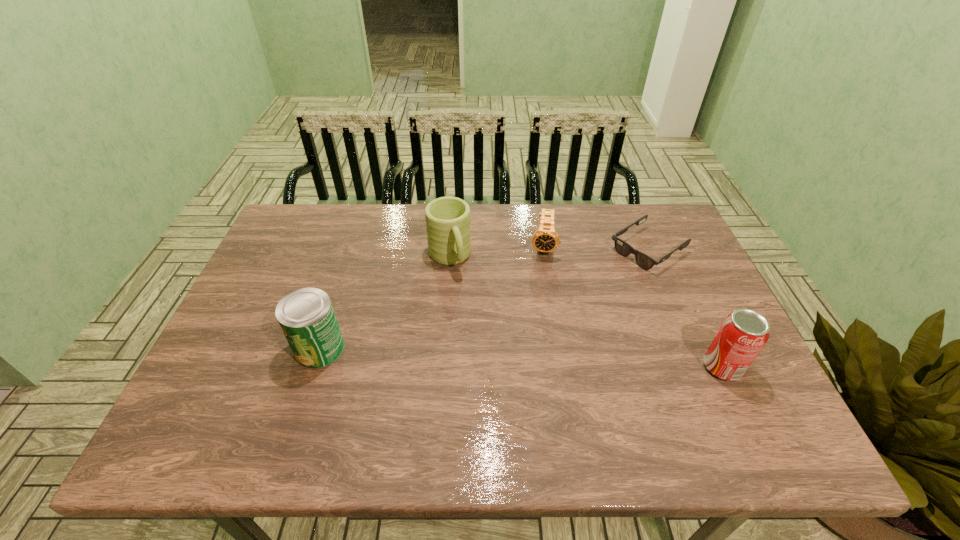
You are a GUI agent. You are given a task and a screenshot of the screen. Output one action in this format:
    pyautogui.click(x=<x>, y=<y>)
    Task: Click on the can
    The width and height of the screenshot is (960, 540).
    Given the screenshot: What is the action you would take?
    pyautogui.click(x=306, y=316)

The image size is (960, 540). Find the location of `soda can`. soda can is located at coordinates (742, 335).

Where is `mug`? mug is located at coordinates (447, 219).

Image resolution: width=960 pixels, height=540 pixels. Identify the location of the shortest object. (623, 248).

Image resolution: width=960 pixels, height=540 pixels. Identify the location of watch. (545, 239).

Locate an element on the screen. The width and height of the screenshot is (960, 540). the third object from left to right is located at coordinates (545, 239).

The width and height of the screenshot is (960, 540). I want to click on vacant space situated 0.370m on the right of the leftmost object, so click(x=494, y=348).

Image resolution: width=960 pixels, height=540 pixels. Identify the location of blank space located 0.350m on the back of the soda can. (670, 256).

Identify the location of vacant region located 0.140m on the side of the fourth object from right to left with the handle. (470, 312).

I want to click on vacant space located 0.130m on the side of the fourth object from right to left with the handle, so click(x=469, y=309).